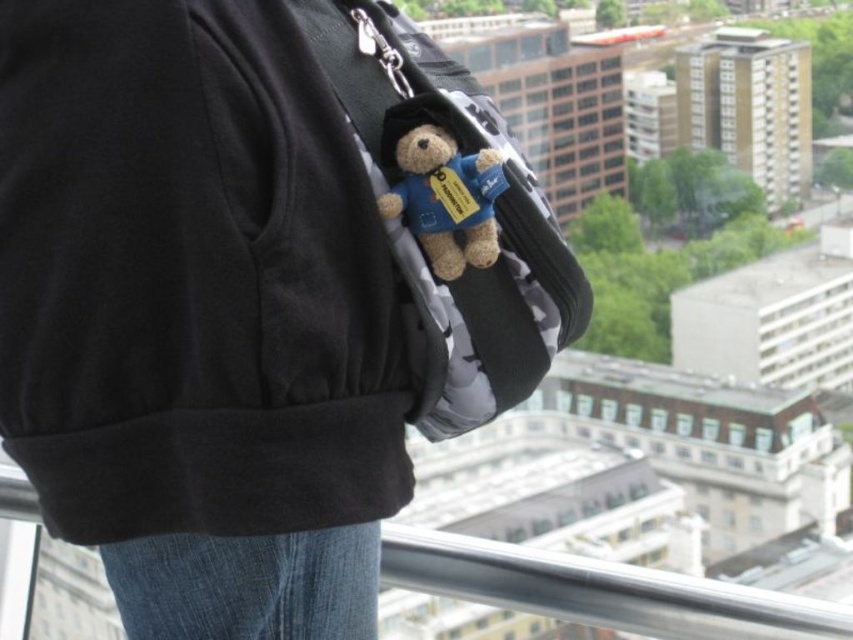
Question: Is camouflage fabric backpack at center behind fuzzy fabric teddy bear at center?

Choices:
 (A) no
 (B) yes

Answer: (A)

Question: Can you confirm if camouflage fabric backpack at center is positioned to the right of fuzzy fabric teddy bear at center?

Choices:
 (A) yes
 (B) no

Answer: (B)

Question: Which point appears farthest from the camera in this image?

Choices:
 (A) (409, 205)
 (B) (36, 81)

Answer: (A)

Question: Is camouflage fabric backpack at center further to camera compared to fuzzy fabric teddy bear at center?

Choices:
 (A) yes
 (B) no

Answer: (B)

Question: Which of the following is the farthest from the observer?

Choices:
 (A) camouflage fabric backpack at center
 (B) fuzzy fabric teddy bear at center

Answer: (B)